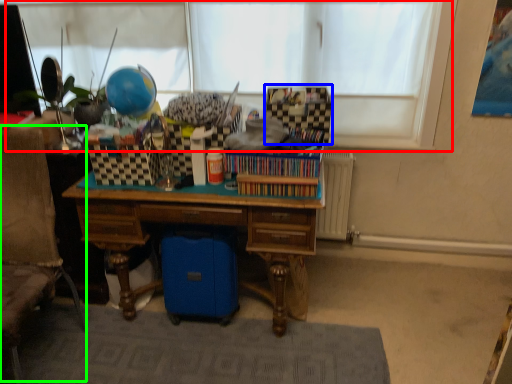
Question: Estimate the real-world distances between objects in this image. Which object is closer to window screen (highlighted by a red box), storage box (highlighted by a blue box) or swivel chair (highlighted by a green box)?

Choices:
 (A) storage box
 (B) swivel chair

Answer: (A)